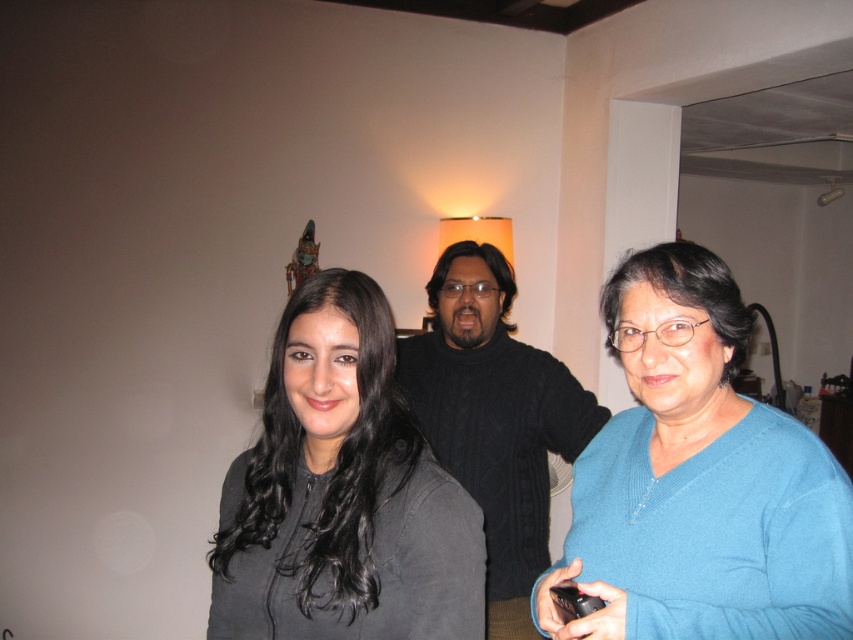
You are standing in the room and want to reach both points, point (254, 554) and point (540, 566). Which point should you reach first if you move directly towards them?

Point (254, 554) is closer to the viewer than point (540, 566), so you should reach point (254, 554) first.